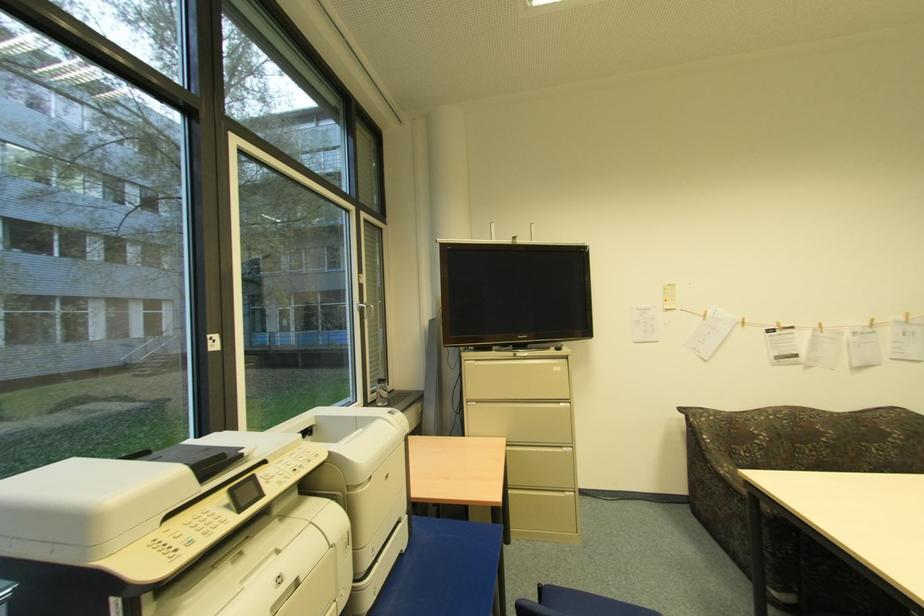
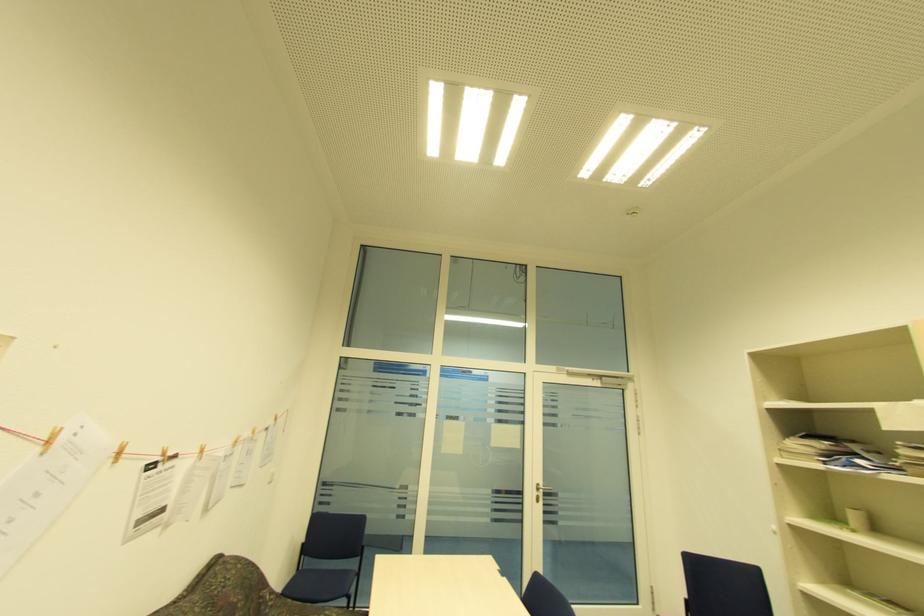
Find the pixel in the second image that matches point (746, 322) in the first image.

(120, 454)